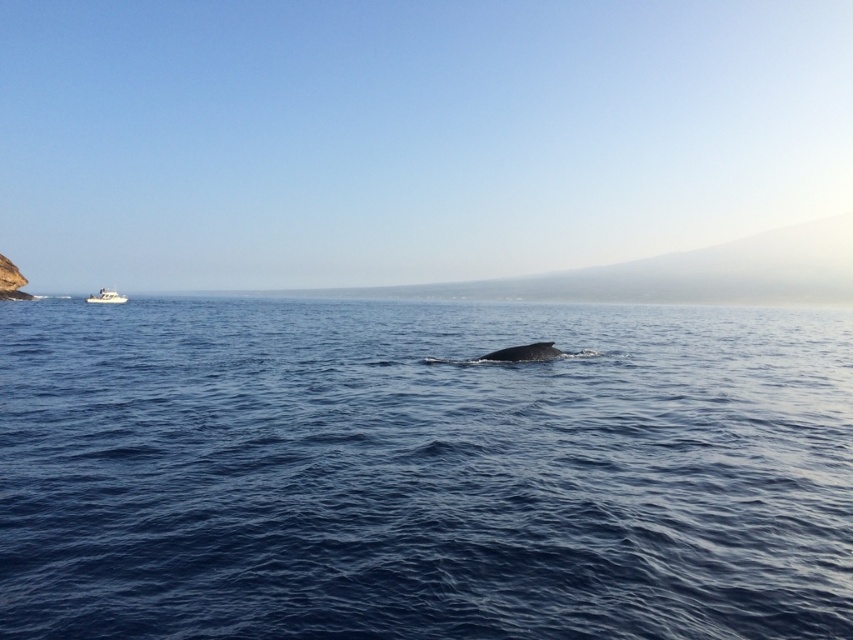
You are a marine biologist observing the ocean scene. You notice the blue water at center and the gray matte whale at center. Which object is positioned to the right of the other?

The blue water at center is to the right of the gray matte whale at center.

You are a marine biologist observing the ocean scene. You notice the gray matte whale at center and the white plastic boat at left. Which object has a narrower width when viewed from above?

The gray matte whale at center is thinner than the white plastic boat at left, so the gray matte whale at center has a narrower width when viewed from above.

You are a photographer taking a picture of the ocean scene. You have two points marked in the image, point A at coordinates point (x=51, y=544) and point B at coordinates point (x=109, y=300). Which point is closer to the camera?

Point A at coordinates point (x=51, y=544) is closer to the camera than point B at coordinates point (x=109, y=300).